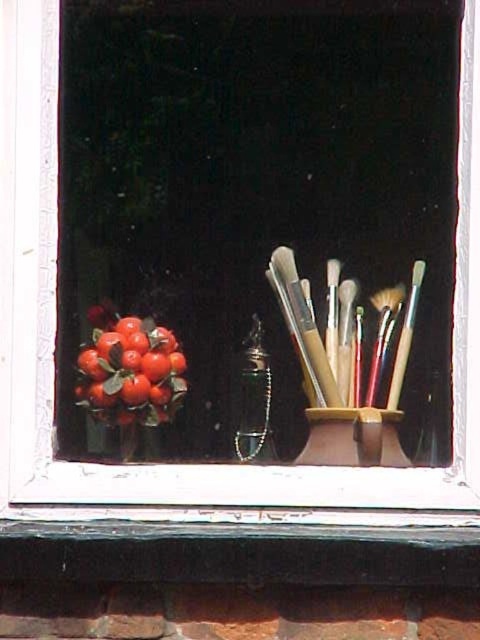
You are a painter who needs to place a 10cm tall sculpture between the shiny red berries at left and the matte black brush at center right. Can the sculpture fit vertically between them?

The shiny red berries at left is taller than matte black brush at center right. The height difference means there is enough vertical space for the 10cm tall sculpture between them.

From the picture: You are a delivery robot trying to place a package on the window sill. The package must be placed exactly at the point specified by the coordinates given in the objects. Which object is located at the coordinates point (130,369)?

The shiny red berries at left is located at point (130,369).

You are a delivery robot that needs to place a small package on the nearest object to the front of the window. Which object should you choose between the shiny red berries at left and the matte black brush at center right?

The shiny red berries at left is closer to the viewer than the matte black brush at center right, so you should place the package on the shiny red berries at left.